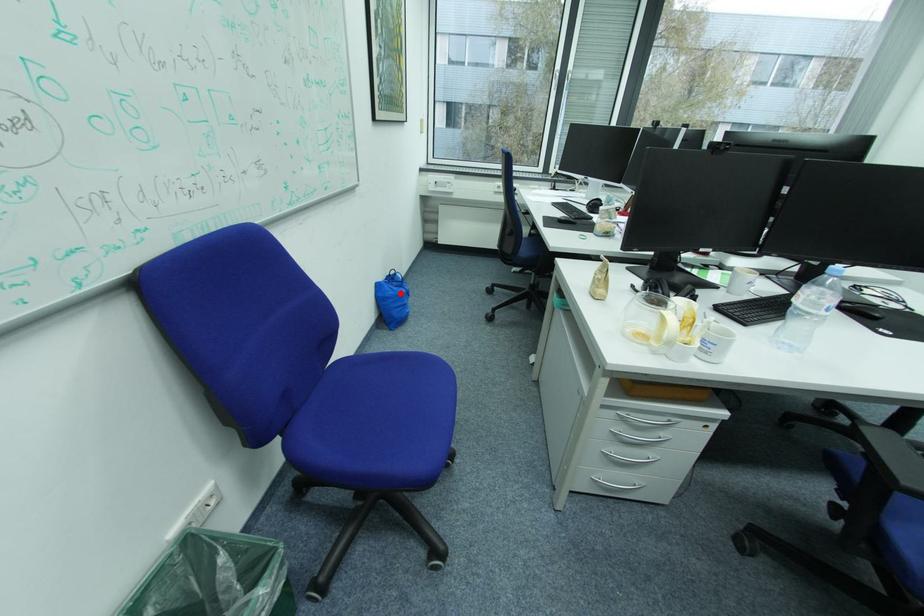
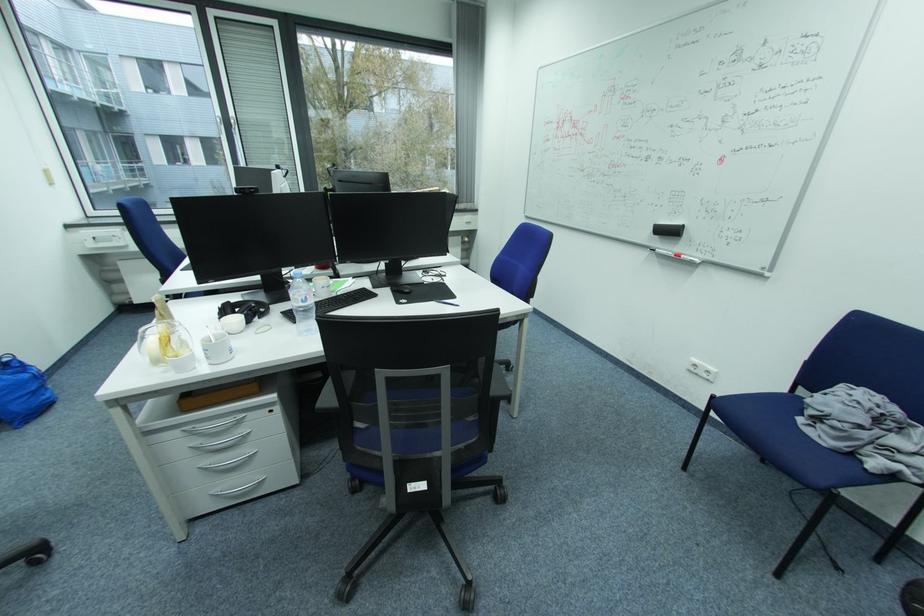
Locate, in the second image, the point that corresponds to the highlighted location in the first image.

(9, 385)